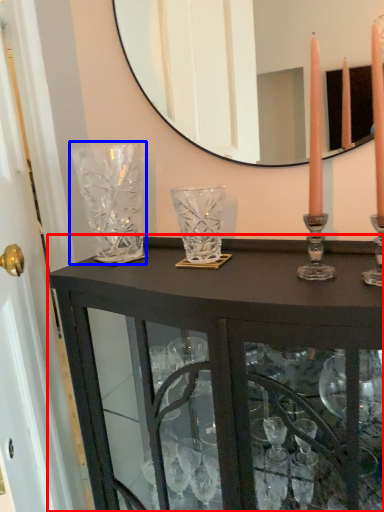
Question: Which object is further to the camera taking this photo, table (highlighted by a red box) or glass vase (highlighted by a blue box)?

Choices:
 (A) table
 (B) glass vase

Answer: (B)